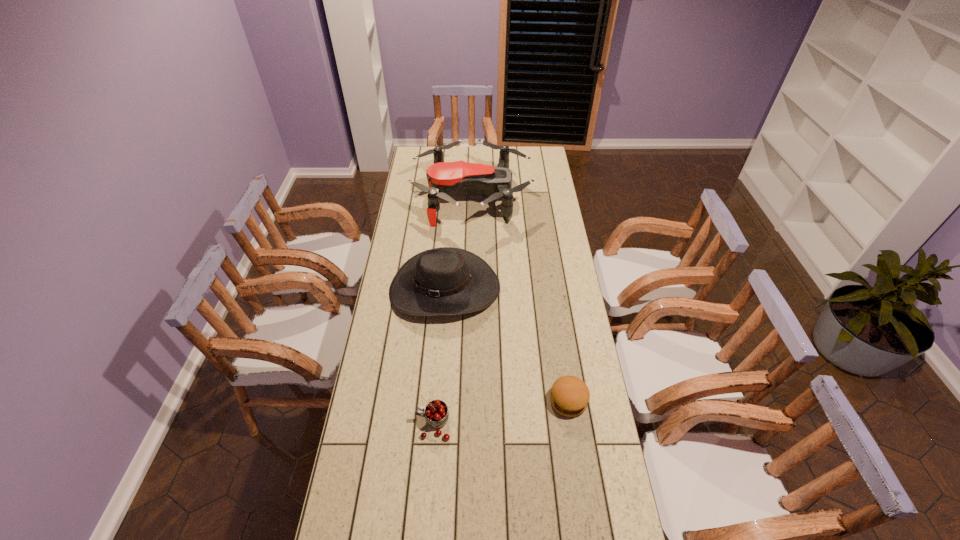
Where is `vacant area that satisfies the following two spatial constraints: 1. on the front-facing side of the second farthest object; 2. on the left side of the shortest object`? The image size is (960, 540). vacant area that satisfies the following two spatial constraints: 1. on the front-facing side of the second farthest object; 2. on the left side of the shortest object is located at coordinates [x=437, y=401].

Where is `vacant space that satisfies the following two spatial constraints: 1. on the front-facing side of the cowboy hat; 2. on the right side of the hamburger`? This screenshot has height=540, width=960. vacant space that satisfies the following two spatial constraints: 1. on the front-facing side of the cowboy hat; 2. on the right side of the hamburger is located at coordinates (437, 401).

I want to click on vacant space that satisfies the following two spatial constraints: 1. on the camera side of the shortest object; 2. on the right side of the drone, so click(x=468, y=401).

The width and height of the screenshot is (960, 540). I want to click on vacant space that satisfies the following two spatial constraints: 1. on the front-facing side of the second farthest object; 2. on the left side of the hamburger, so click(x=437, y=401).